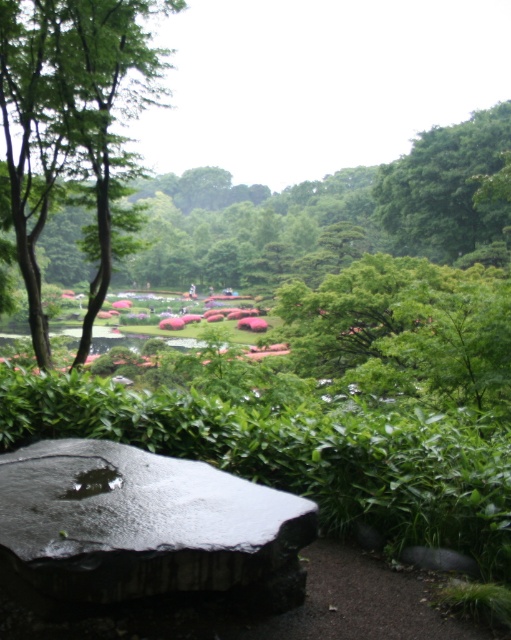
What are the coordinates of `shiny black stone at lower left` in the screenshot? It's located at (147, 525).

Which of these two, shiny black stone at lower left or green leafy tree at left, stands taller?

green leafy tree at left is taller.

Is point (164, 513) closer to camera compared to point (81, 124)?

Yes, point (164, 513) is closer to viewer.

Find the location of a particular element. This screenshot has width=511, height=640. shiny black stone at lower left is located at coordinates (147, 525).

Which is above, green leafy tree at left or green leafy tree at upper right?

green leafy tree at upper right is above.

Who is more forward, [112,108] or [396,211]?

Point [112,108] is in front.

I want to click on green leafy tree at left, so click(73, 122).

Is shiny black stone at lower left above green leafy tree at upper right?

Incorrect, shiny black stone at lower left is not positioned above green leafy tree at upper right.

The width and height of the screenshot is (511, 640). Describe the element at coordinates (147, 525) in the screenshot. I see `shiny black stone at lower left` at that location.

Between point (121, 496) and point (493, 136), which one is positioned in front?

Point (121, 496) is in front.

Find the location of a particular element. shiny black stone at lower left is located at coordinates (147, 525).